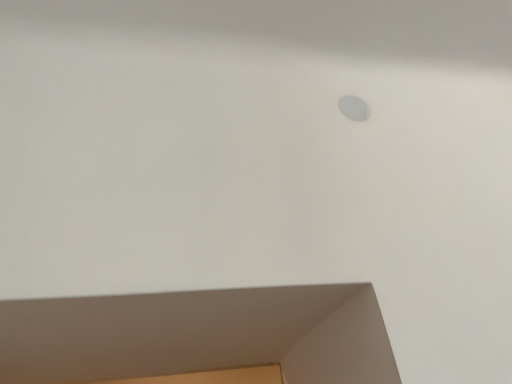
Locate an element on the screen. The height and width of the screenshot is (384, 512). matte white box at lower left is located at coordinates (199, 335).

What do you see at coordinates (199, 335) in the screenshot? I see `matte white box at lower left` at bounding box center [199, 335].

At what (x,y) coordinates should I click in order to perform the action: click on matte white box at lower left. Please return your answer as a coordinate pair (x, y). This screenshot has height=384, width=512. Looking at the image, I should click on (199, 335).